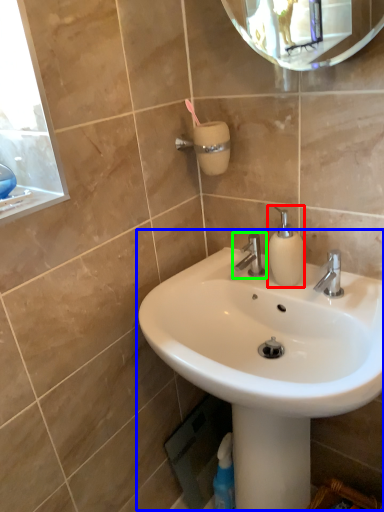
Question: Based on their relative distances, which object is nearer to soap dispenser (highlighted by a red box)? Choose from sink (highlighted by a blue box) and tap (highlighted by a green box).

Choices:
 (A) sink
 (B) tap

Answer: (B)